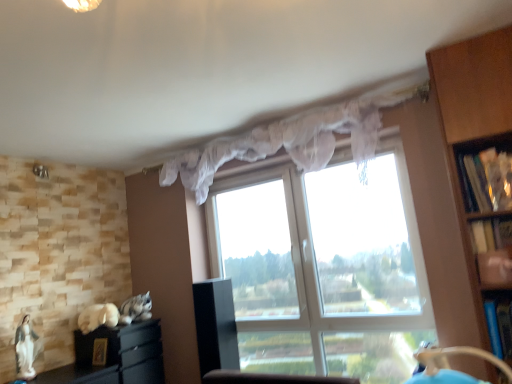
Question: Relative to blue plastic shelf at right, which is counted as the 1th shelf, starting from the bottom, is black matte cabinet at lower left, the 1th cabinetry from the left, in front or behind?

Choices:
 (A) behind
 (B) front

Answer: (A)

Question: Considering the relative positions of black matte cabinet at lower left, the 1th cabinetry from the left, and blue plastic shelf at right, positioned as the third shelf in top-to-bottom order, in the image provided, is black matte cabinet at lower left, the 1th cabinetry from the left, to the left or to the right of blue plastic shelf at right, positioned as the third shelf in top-to-bottom order,?

Choices:
 (A) left
 (B) right

Answer: (A)

Question: Which object is the farthest from the blue plastic shelf at right, which is counted as the 1th shelf, starting from the bottom?

Choices:
 (A) white fur cat at lower left, which is the 1th animal from left to right
 (B) transparent fabric window at center
 (C) wooden bookshelf at right, which appears as the first shelf when viewed from the top
 (D) wooden bookshelf at right, which is counted as the 2th shelf, starting from the top
 (E) black glossy cabinet at center, the second cabinetry in the left-to-right sequence

Answer: (A)

Question: Which object is positioned closest to the blue plastic shelf at right, which is counted as the 1th shelf, starting from the bottom?

Choices:
 (A) translucent fabric curtain at upper center
 (B) fluffy gray cat at lower left, arranged as the first animal when viewed from the right
 (C) wooden bookshelf at right, marked as the third shelf in a bottom-to-top arrangement
 (D) black glossy cabinet at center, the second cabinetry in the left-to-right sequence
 (E) wooden bookshelf at right, the second shelf from the bottom

Answer: (E)